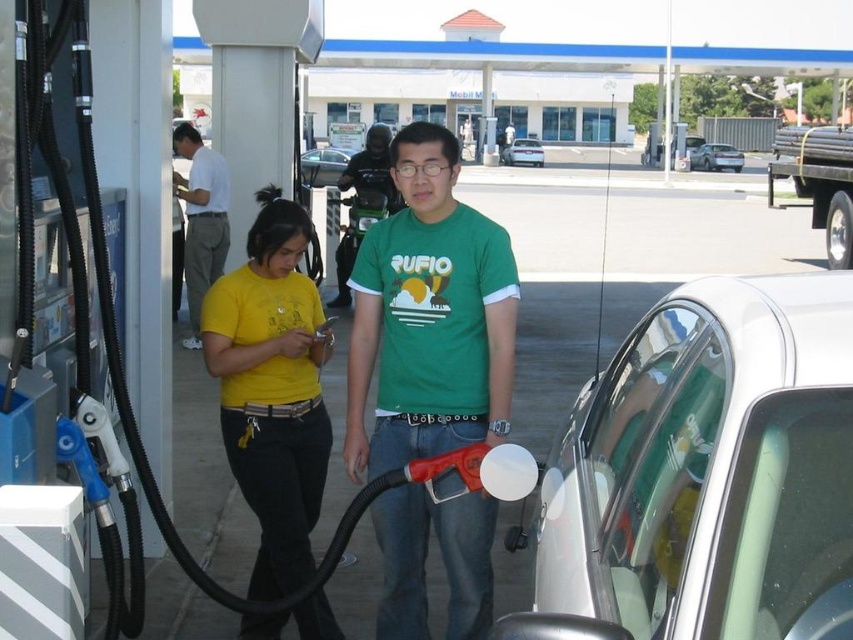
Question: Which point is farther to the camera?

Choices:
 (A) (317, 168)
 (B) (223, 243)
 (C) (732, 166)
 (D) (538, 145)

Answer: (D)

Question: Which of the following is the farthest from the observer?

Choices:
 (A) (364, 141)
 (B) (538, 160)
 (C) (198, 285)
 (D) (262, 593)

Answer: (B)

Question: Where is yellow matte shirt at center located in relation to green matte t-shirt at center in the image?

Choices:
 (A) left
 (B) right

Answer: (B)

Question: Is white glossy car at right below yellow matte shirt at center?

Choices:
 (A) yes
 (B) no

Answer: (B)

Question: Does white cotton shirt at left have a greater width compared to silver metallic sedan at center?

Choices:
 (A) no
 (B) yes

Answer: (A)

Question: Which of these objects is positioned farthest from the white cotton shirt at left?

Choices:
 (A) silver metallic sedan at center
 (B) yellow matte shirt at center

Answer: (A)